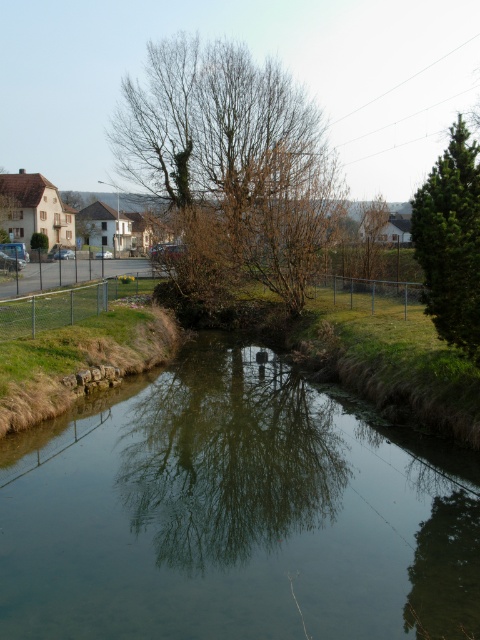
Question: Which object appears closest to the camera in this image?

Choices:
 (A) green textured pine tree at right
 (B) bare brown tree at center

Answer: (A)

Question: Which point is farther to the camera?

Choices:
 (A) (459, 230)
 (B) (276, 106)

Answer: (B)

Question: Can you confirm if bare brown tree at center is positioned above green textured pine tree at right?

Choices:
 (A) no
 (B) yes

Answer: (A)

Question: From the image, what is the correct spatial relationship of bare brown tree at center in relation to green textured pine tree at right?

Choices:
 (A) above
 (B) below

Answer: (B)

Question: Is bare brown tree at center thinner than green textured pine tree at right?

Choices:
 (A) no
 (B) yes

Answer: (B)